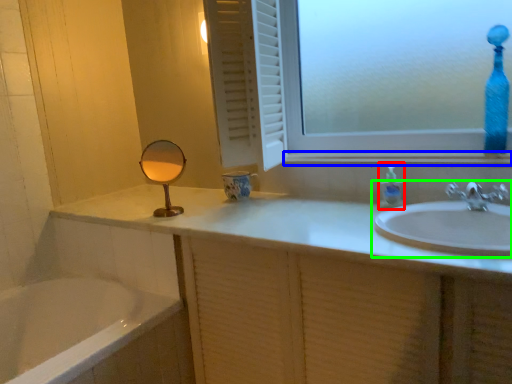
Question: Which object is positioned farthest from soap dispenser (highlighted by a red box)? Select from window sill (highlighted by a blue box) and sink (highlighted by a green box).

Choices:
 (A) window sill
 (B) sink

Answer: (B)